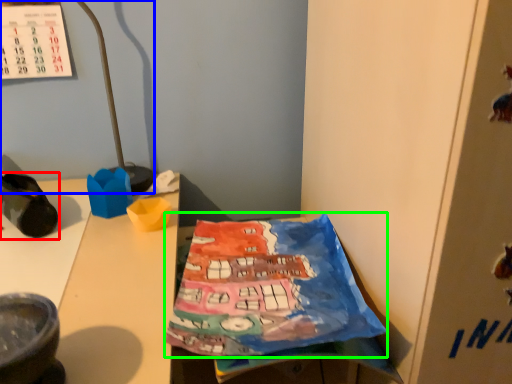
Question: Which is farther away from footwear (highlighted by a red box)? lamp (highlighted by a blue box) or wrapping paper (highlighted by a green box)?

Choices:
 (A) lamp
 (B) wrapping paper

Answer: (B)